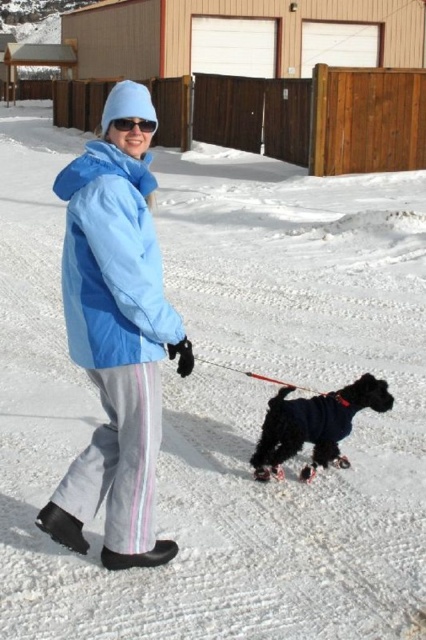
Looking at this image, does blue fabric jacket at center have a larger size compared to shiny black coat at lower center?

Yes, blue fabric jacket at center is bigger than shiny black coat at lower center.

Which is above, blue fabric jacket at center or shiny black coat at lower center?

Positioned higher is blue fabric jacket at center.

The width and height of the screenshot is (426, 640). What are the coordinates of `blue fabric jacket at center` in the screenshot? It's located at (115, 337).

Locate an element on the screen. blue fabric jacket at center is located at coordinates (115, 337).

Who is positioned more to the right, shiny black coat at lower center or blue reflective sunglasses at upper center?

Positioned to the right is shiny black coat at lower center.

Does point (360, 380) come farther from viewer compared to point (140, 125)?

Yes, point (360, 380) is behind point (140, 125).

Does point (258, 470) come closer to viewer compared to point (106, 129)?

That is False.

The image size is (426, 640). Identify the location of shiny black coat at lower center. (313, 426).

Who is positioned more to the left, blue fabric jacket at center or blue matte jacket at center?

blue fabric jacket at center

Locate an element on the screen. This screenshot has height=640, width=426. blue fabric jacket at center is located at coordinates (115, 337).

This screenshot has height=640, width=426. In order to click on blue fabric jacket at center in this screenshot , I will do `click(115, 337)`.